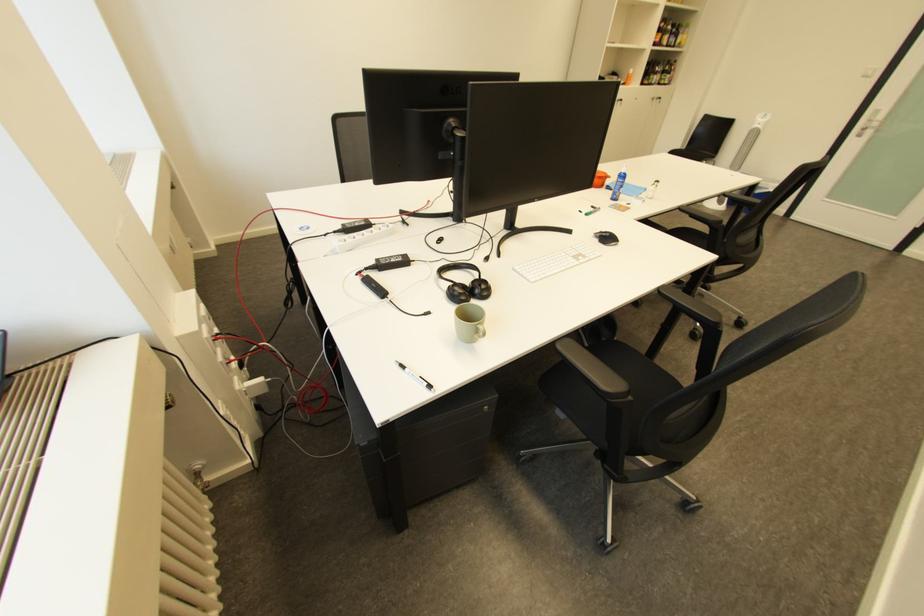
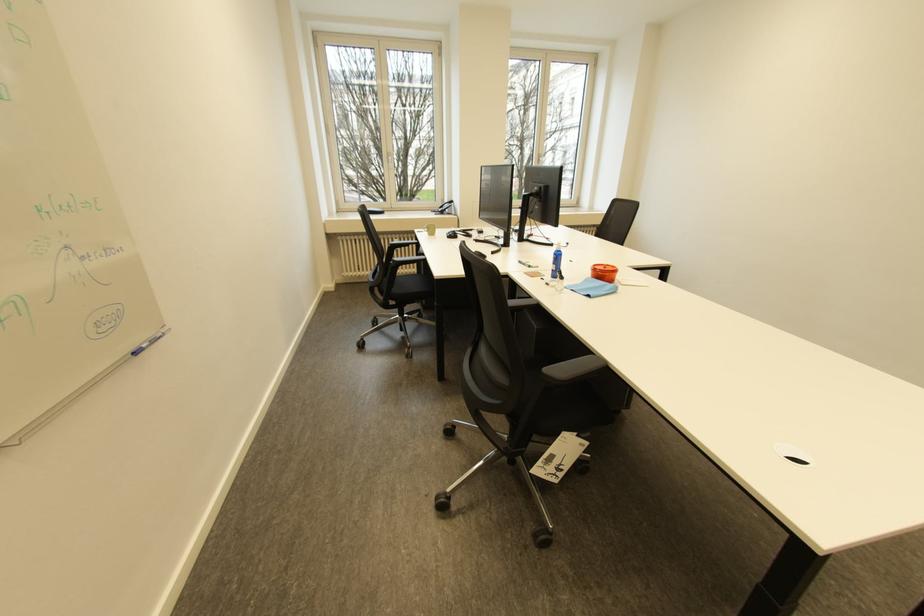
Locate, in the second image, the point that corresponds to (x=440, y=387) in the first image.

(428, 233)